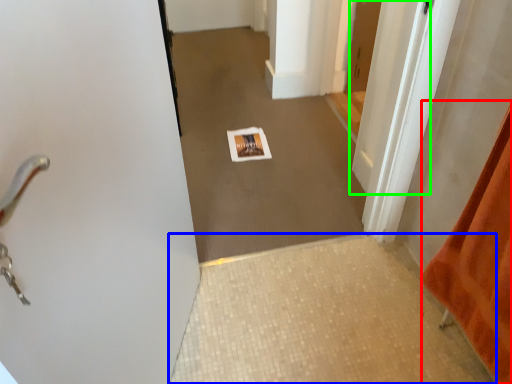
Question: Estimate the real-world distances between objects in this image. Which object is closer to blanket (highlighted by a red box), tile (highlighted by a blue box) or door (highlighted by a green box)?

Choices:
 (A) tile
 (B) door

Answer: (A)